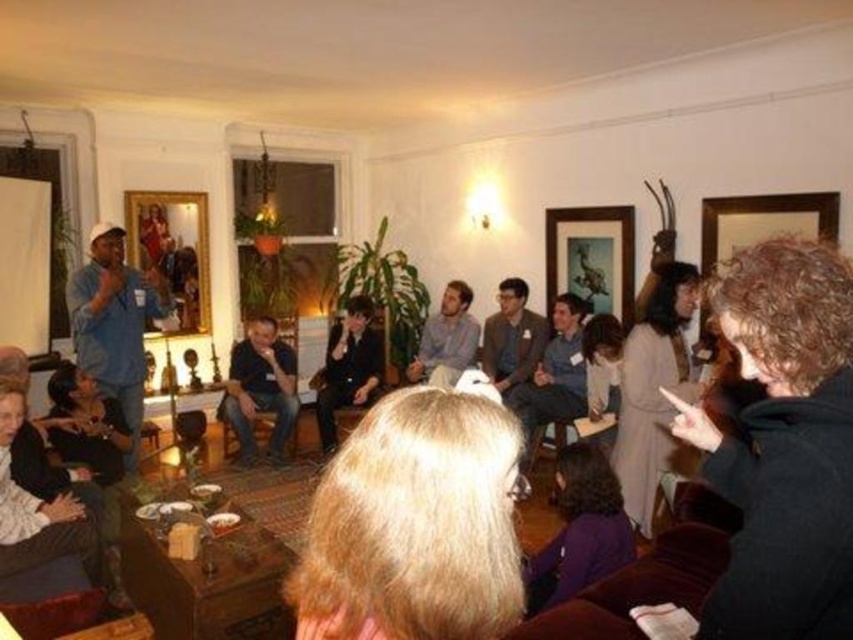
Measure the distance between point (154,300) and camera.

4.86 meters

Does point (82, 346) come farther from viewer compared to point (270, 380)?

No, it is in front of (270, 380).

Image resolution: width=853 pixels, height=640 pixels. In order to click on blue denim shirt at left in this screenshot , I will do `click(115, 324)`.

The image size is (853, 640). In order to click on blue denim shirt at left in this screenshot , I will do `click(115, 324)`.

Does dark purple sweater at lower center have a larger size compared to dark gray sweater at center?

No.

Is point (561, 460) positioned after point (527, 378)?

No, (561, 460) is closer to viewer.

Identify the location of dark purple sweater at lower center. (579, 529).

Does dark purple sweater at lower center lie behind dark blue shirt at center?

No, it is not.

Is dark purple sweater at lower center shorter than dark blue shirt at center?

Indeed, dark purple sweater at lower center has a lesser height compared to dark blue shirt at center.

This screenshot has width=853, height=640. Identify the location of dark purple sweater at lower center. (579, 529).